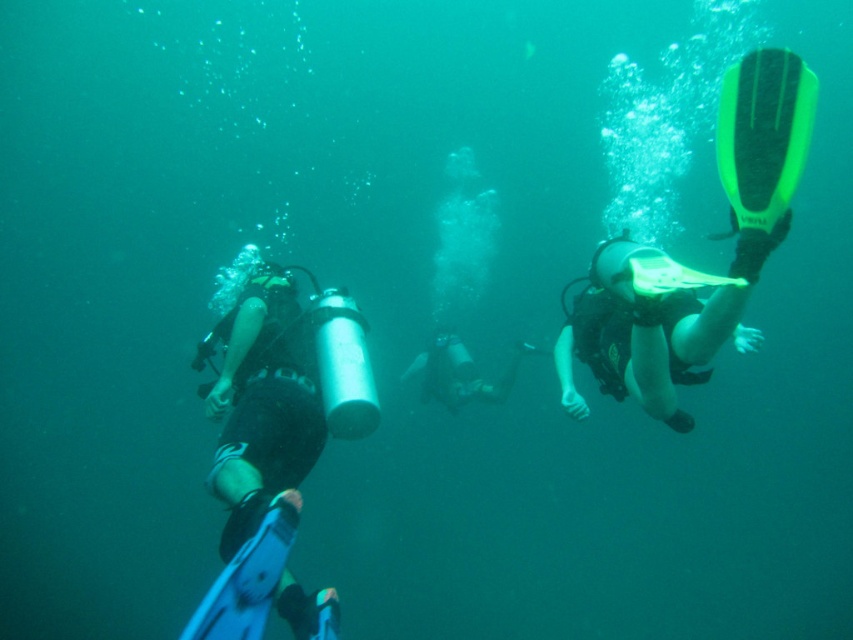
You are a marine biologist observing two divers underwater. You notice the black matte wetsuit at left and the black matte wetsuit at center. Which diver is taller?

The black matte wetsuit at left is taller than the black matte wetsuit at center.

You are a marine biologist observing underwater divers. You see the neon yellow rubber fin at right and the black matte wetsuit at center. Which object is positioned further to the right in the scene?

The neon yellow rubber fin at right is positioned further to the right than the black matte wetsuit at center according to the description.

Looking at this image, you are a marine biologist observing the underwater scene. You notice the black matte wetsuit at left and the neon yellow rubber fin at right. Which object is wider in the image?

The black matte wetsuit at left is wider than the neon yellow rubber fin at right according to the description.